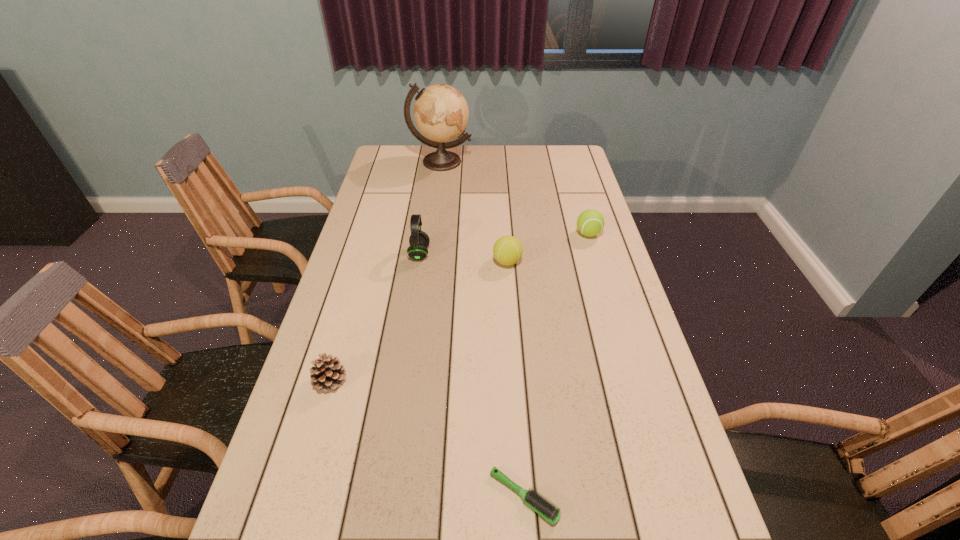
I want to click on globe, so click(x=441, y=113).

Find the location of a particular element. the farthest object is located at coordinates (441, 113).

Identify the location of headset. The width and height of the screenshot is (960, 540). (419, 241).

Find the location of a particular element. the nearer tennis ball is located at coordinates click(507, 250).

You are a GUI agent. You are given a task and a screenshot of the screen. Output one action in this format:
    pyautogui.click(x=<x>, y=<y>)
    Task: Click on the right tennis ball
    The height and width of the screenshot is (540, 960).
    Given the screenshot: What is the action you would take?
    pyautogui.click(x=590, y=222)

Where is `the rightmost object`? Image resolution: width=960 pixels, height=540 pixels. the rightmost object is located at coordinates (590, 222).

Locate an element on the screen. This screenshot has width=960, height=540. pinecone is located at coordinates (328, 373).

Locate an element on the screen. This screenshot has height=540, width=960. the second nearest object is located at coordinates (328, 373).

The width and height of the screenshot is (960, 540). I want to click on the nearest object, so click(x=551, y=513).

Locate an element on the screen. Image resolution: width=960 pixels, height=540 pixels. hairbrush is located at coordinates (551, 513).